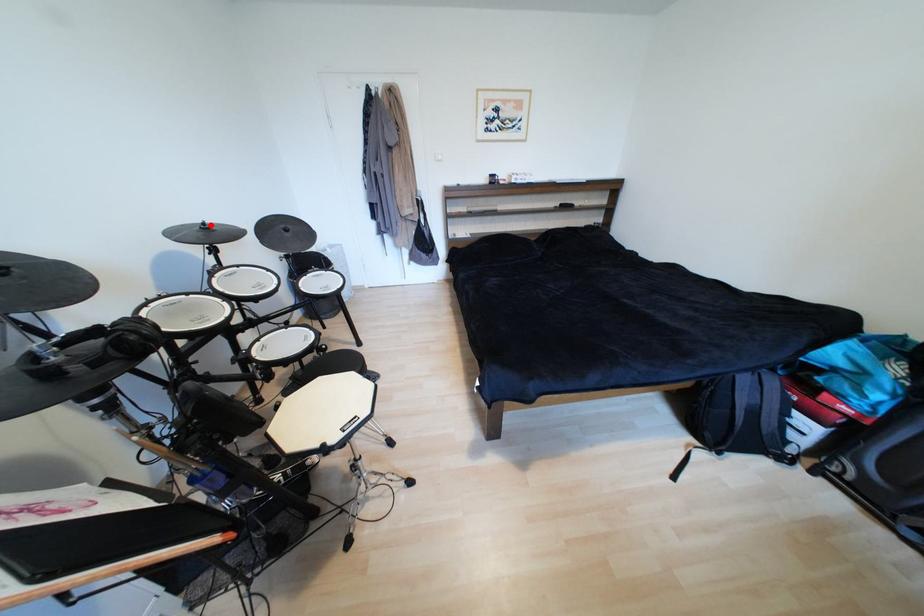
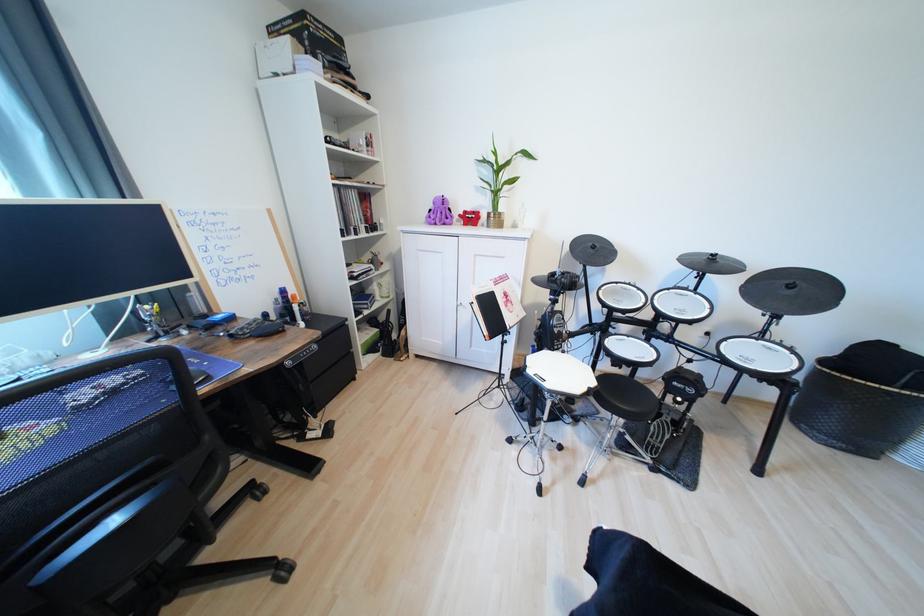
The point at the highlighted location is marked in the first image. Where is the corresponding point in the second image?

(721, 257)